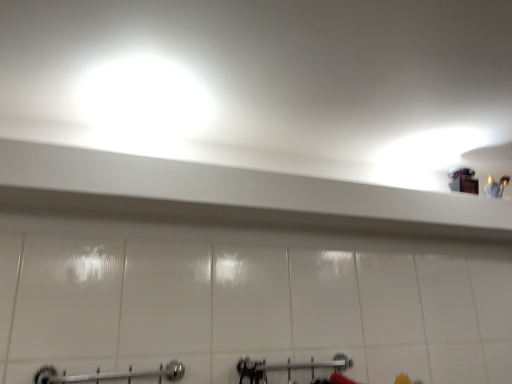
Question: From a real-world perspective, does brushed metal shower at lower center stand above chrome metallic towel rack at lower center?

Choices:
 (A) no
 (B) yes

Answer: (A)

Question: Are brushed metal shower at lower center and chrome metallic towel rack at lower center beside each other?

Choices:
 (A) yes
 (B) no

Answer: (B)

Question: Is brushed metal shower at lower center positioned behind chrome metallic towel rack at lower center?

Choices:
 (A) no
 (B) yes

Answer: (B)

Question: Can you confirm if brushed metal shower at lower center is shorter than chrome metallic towel rack at lower center?

Choices:
 (A) no
 (B) yes

Answer: (A)

Question: Is brushed metal shower at lower center thinner than chrome metallic towel rack at lower center?

Choices:
 (A) no
 (B) yes

Answer: (A)

Question: Is brushed metal shower at lower center bigger than chrome metallic towel rack at lower center?

Choices:
 (A) yes
 (B) no

Answer: (A)

Question: From a real-world perspective, is chrome metallic towel rack at lower center over brushed metal shower at lower center?

Choices:
 (A) yes
 (B) no

Answer: (A)

Question: Can you confirm if chrome metallic towel rack at lower center is taller than brushed metal shower at lower center?

Choices:
 (A) no
 (B) yes

Answer: (A)

Question: Is brushed metal shower at lower center at the back of chrome metallic towel rack at lower center?

Choices:
 (A) no
 (B) yes

Answer: (A)

Question: Considering the relative sizes of chrome metallic towel rack at lower center and brushed metal shower at lower center in the image provided, is chrome metallic towel rack at lower center bigger than brushed metal shower at lower center?

Choices:
 (A) yes
 (B) no

Answer: (B)

Question: Does chrome metallic towel rack at lower center contain brushed metal shower at lower center?

Choices:
 (A) no
 (B) yes

Answer: (A)

Question: Is chrome metallic towel rack at lower center closer to camera compared to brushed metal shower at lower center?

Choices:
 (A) yes
 (B) no

Answer: (A)

Question: From the image's perspective, is chrome metallic towel rack at lower center above or below brushed metal shower at lower center?

Choices:
 (A) above
 (B) below

Answer: (A)